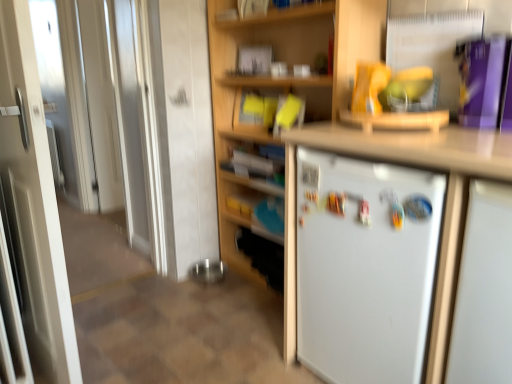
Question: From the image's perspective, is white glossy door at left beneath white matte refrigerator at right?

Choices:
 (A) yes
 (B) no

Answer: (B)

Question: Is white glossy door at left closer to camera compared to white matte refrigerator at right?

Choices:
 (A) yes
 (B) no

Answer: (B)

Question: Considering the relative positions of white glossy door at left and white matte refrigerator at right in the image provided, is white glossy door at left behind white matte refrigerator at right?

Choices:
 (A) yes
 (B) no

Answer: (A)

Question: Is white glossy door at left shorter than white matte refrigerator at right?

Choices:
 (A) no
 (B) yes

Answer: (A)

Question: Can you confirm if white glossy door at left is thinner than white matte refrigerator at right?

Choices:
 (A) yes
 (B) no

Answer: (A)

Question: From a real-world perspective, is beige tile at lower center positioned above or below white matte refrigerator at right?

Choices:
 (A) below
 (B) above

Answer: (A)

Question: Considering the positions of beige tile at lower center and white matte refrigerator at right in the image, is beige tile at lower center taller or shorter than white matte refrigerator at right?

Choices:
 (A) short
 (B) tall

Answer: (A)

Question: Is beige tile at lower center wider or thinner than white matte refrigerator at right?

Choices:
 (A) thin
 (B) wide

Answer: (B)

Question: From the image's perspective, is beige tile at lower center positioned above or below white matte refrigerator at right?

Choices:
 (A) above
 (B) below

Answer: (B)

Question: In the image, is beige tile at lower center positioned in front of or behind wooden bookshelf at center?

Choices:
 (A) behind
 (B) front

Answer: (B)

Question: In the image, is beige tile at lower center on the left side or the right side of wooden bookshelf at center?

Choices:
 (A) left
 (B) right

Answer: (A)

Question: Looking at their shapes, would you say beige tile at lower center is wider or thinner than wooden bookshelf at center?

Choices:
 (A) thin
 (B) wide

Answer: (B)

Question: From a real-world perspective, is beige tile at lower center above or below wooden bookshelf at center?

Choices:
 (A) below
 (B) above

Answer: (A)

Question: Is white matte refrigerator at center in front of or behind white glossy door at left in the image?

Choices:
 (A) front
 (B) behind

Answer: (A)

Question: Looking at their shapes, would you say white matte refrigerator at center is wider or thinner than white glossy door at left?

Choices:
 (A) wide
 (B) thin

Answer: (A)